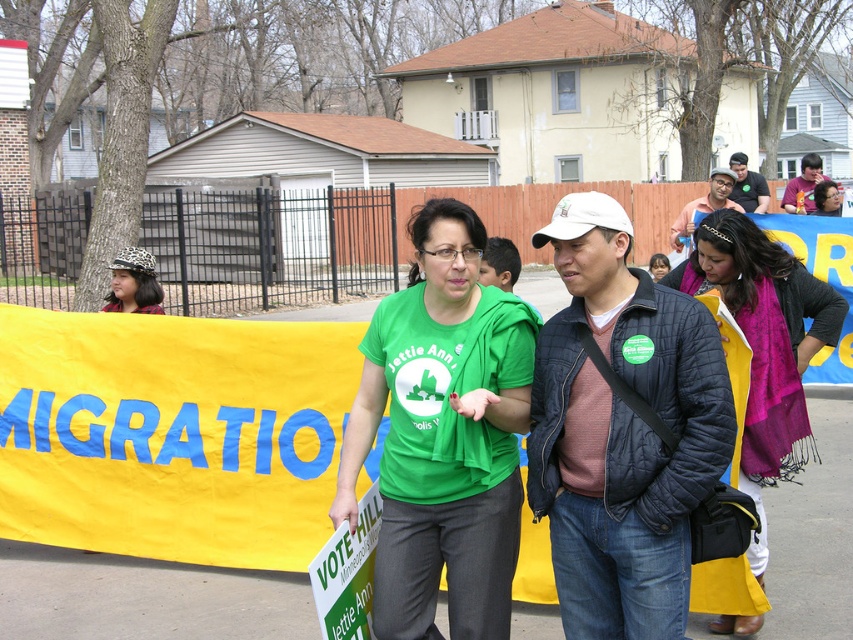
Which of these two, quilted black jacket at center or matte pink scarf at center, stands shorter?

quilted black jacket at center is shorter.

Does quilted black jacket at center have a smaller size compared to matte pink scarf at center?

Indeed, quilted black jacket at center has a smaller size compared to matte pink scarf at center.

Does point (567, 275) come in front of point (811, 179)?

That is True.

The width and height of the screenshot is (853, 640). Find the location of `quilted black jacket at center`. quilted black jacket at center is located at coordinates (621, 429).

How much distance is there between quilted black jacket at center and matte black jacket at center?

quilted black jacket at center is 5.65 meters away from matte black jacket at center.

Between quilted black jacket at center and matte black jacket at center, which one is positioned higher?

matte black jacket at center

The image size is (853, 640). What do you see at coordinates (621, 429) in the screenshot? I see `quilted black jacket at center` at bounding box center [621, 429].

Locate an element on the screen. The width and height of the screenshot is (853, 640). quilted black jacket at center is located at coordinates (621, 429).

Does quilted black jacket at center appear under matte black t-shirt at center?

Yes, quilted black jacket at center is below matte black t-shirt at center.

Between quilted black jacket at center and matte black t-shirt at center, which one is positioned lower?

quilted black jacket at center is below.

Locate an element on the screen. The height and width of the screenshot is (640, 853). quilted black jacket at center is located at coordinates (621, 429).